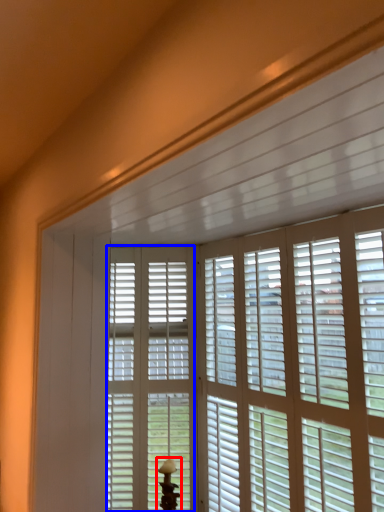
Question: Which object appears closest to the camera in this image, table lamp (highlighted by a red box) or screen door (highlighted by a blue box)?

Choices:
 (A) table lamp
 (B) screen door

Answer: (A)